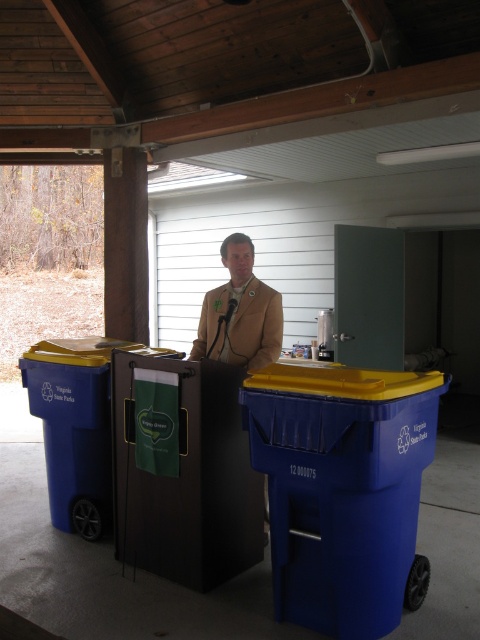
You are a park visitor who wants to place a water bottle into the correct container. The blue plastic cooler at center and the blue plastic recycling bin at left are both blue. Which one is positioned lower in the scene?

The blue plastic cooler at center is located below the blue plastic recycling bin at left, so the cooler is lower.

Consider the image. You are organizing a picnic and need to place both the blue plastic cooler at center and the tan fabric jacket at center into a storage box. The box has a width of 1 meter. Can both items fit side by side horizontally?

The blue plastic cooler at center might be wider than tan fabric jacket at center, so there is uncertainty if both can fit side by side horizontally in a 1 meter wide box. Measure both items to confirm.